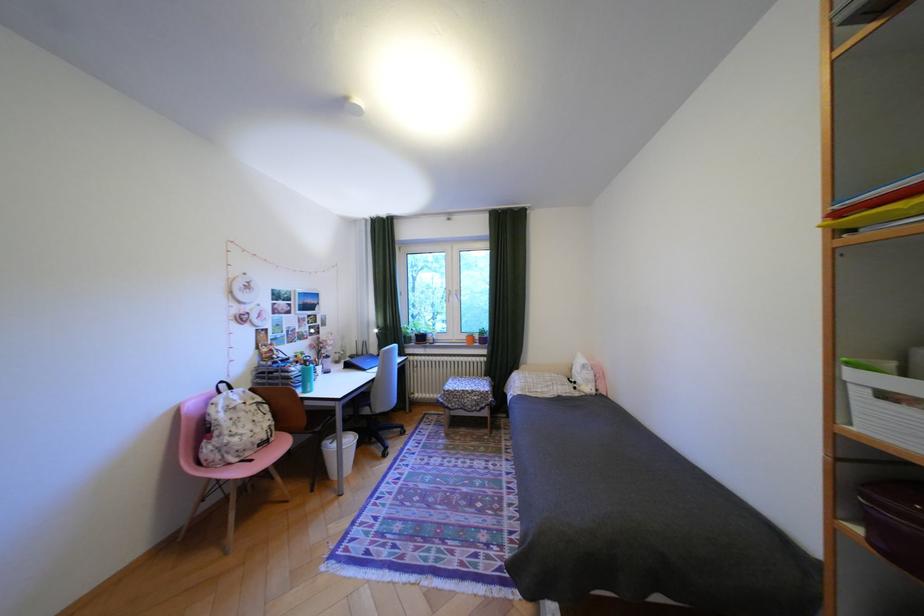
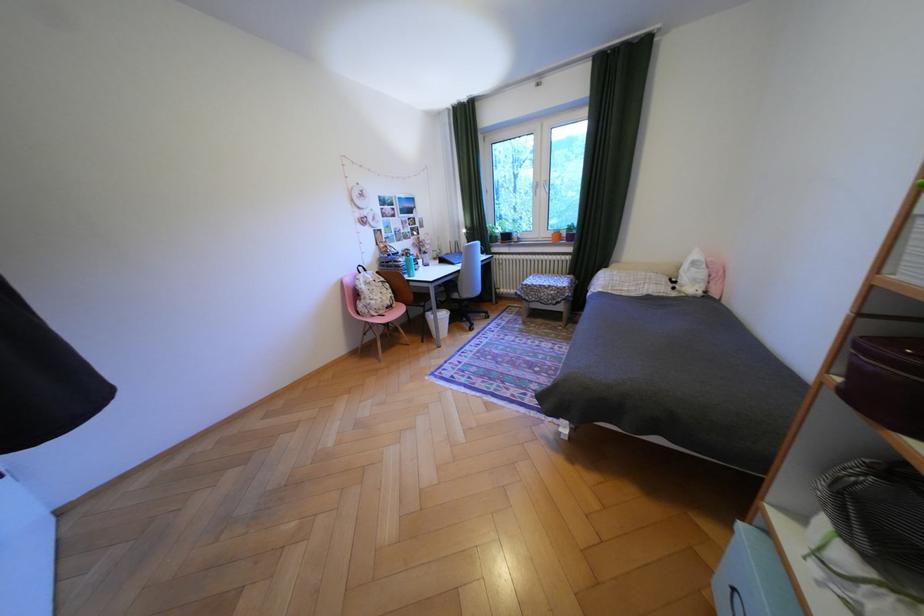
The point at (587, 383) is marked in the first image. Where is the corresponding point in the second image?

(687, 282)